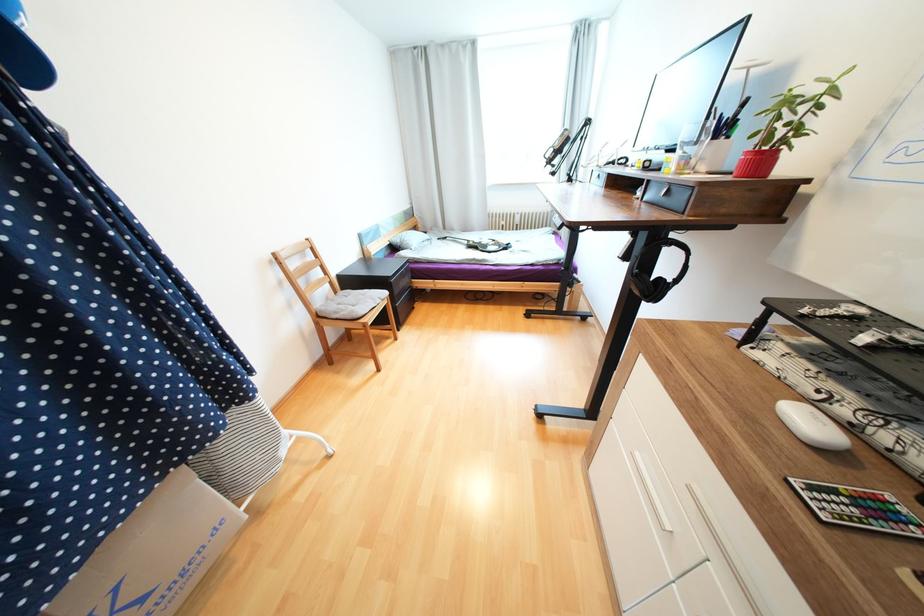
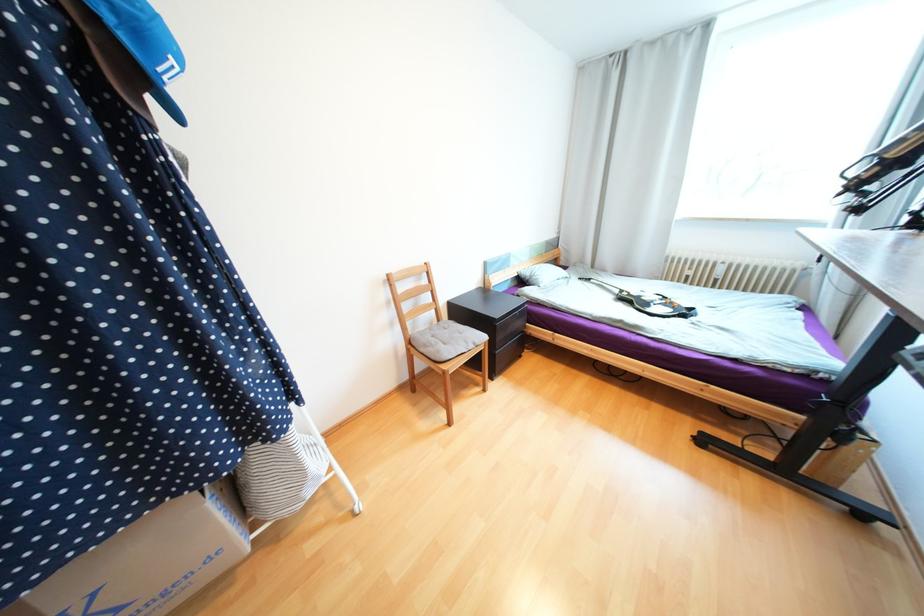
Locate, in the second image, the point that corresponds to pixel 471 243 in the first image.

(623, 292)